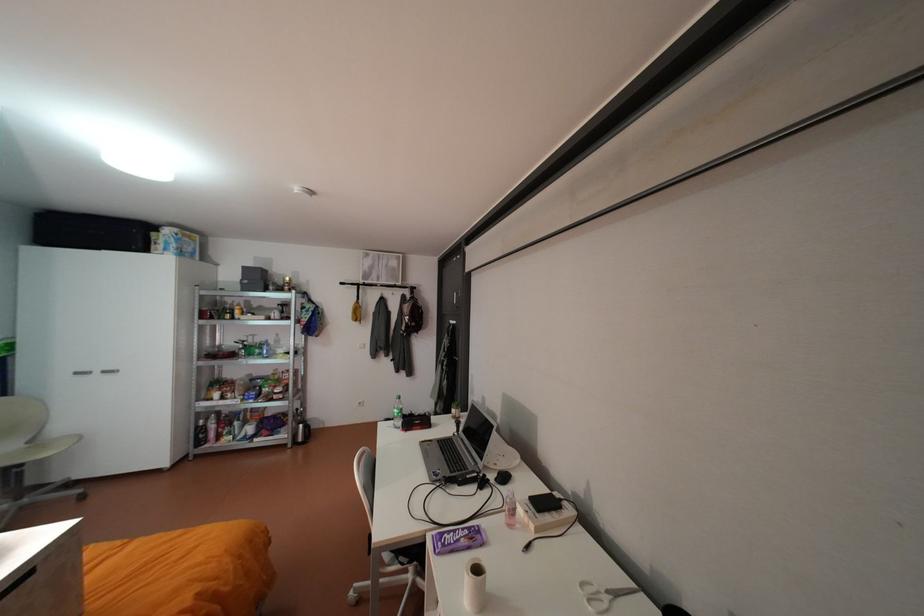
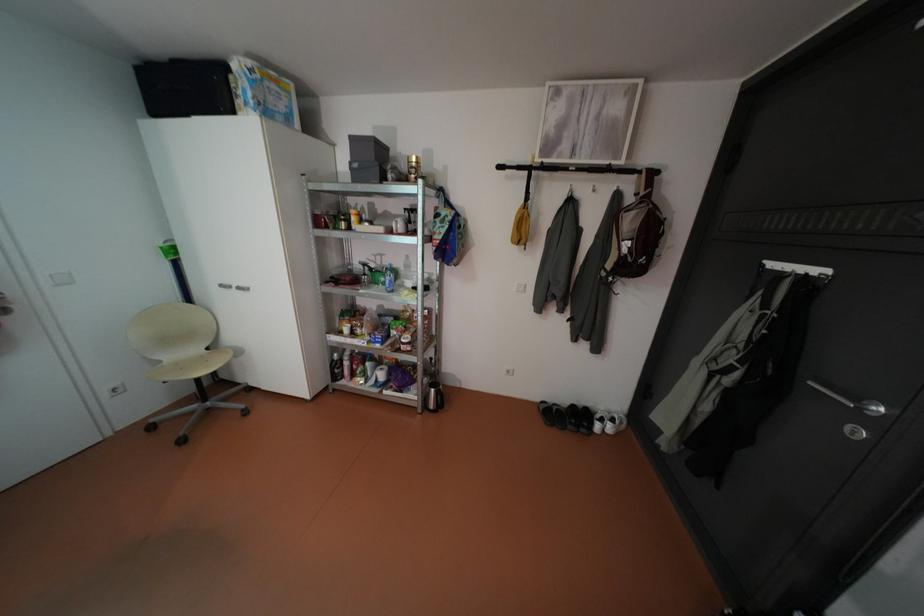
Find the pixel in the second image that matches the point at 350,283 in the first image.

(508, 166)